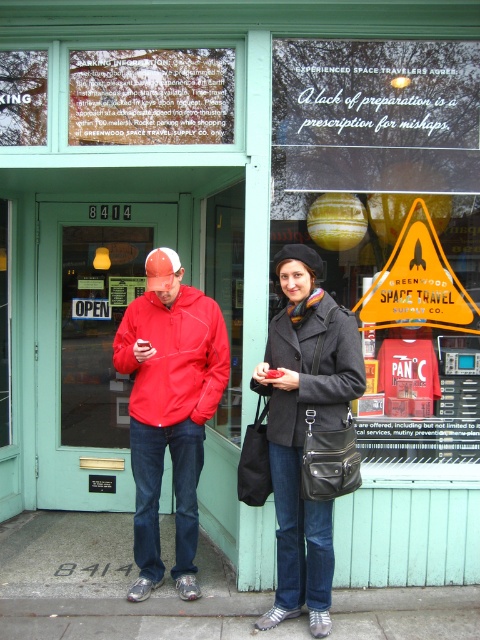
Question: Where is red fleece jacket at center located in relation to matte black coat at center in the image?

Choices:
 (A) below
 (B) above

Answer: (B)

Question: Considering the real-world distances, which object is farthest from the red matte jacket at center?

Choices:
 (A) matte black coat at center
 (B) red fleece jacket at center

Answer: (B)

Question: Is red fleece jacket at center positioned behind matte black coat at center?

Choices:
 (A) no
 (B) yes

Answer: (B)

Question: Which is nearer to the red matte jacket at center?

Choices:
 (A) red fleece jacket at center
 (B) matte black coat at center

Answer: (B)

Question: From the image, what is the correct spatial relationship of red matte jacket at center in relation to matte black coat at center?

Choices:
 (A) above
 (B) below

Answer: (A)

Question: Which of the following is the closest to the observer?

Choices:
 (A) red fleece jacket at center
 (B) matte black coat at center
 (C) red matte jacket at center

Answer: (C)